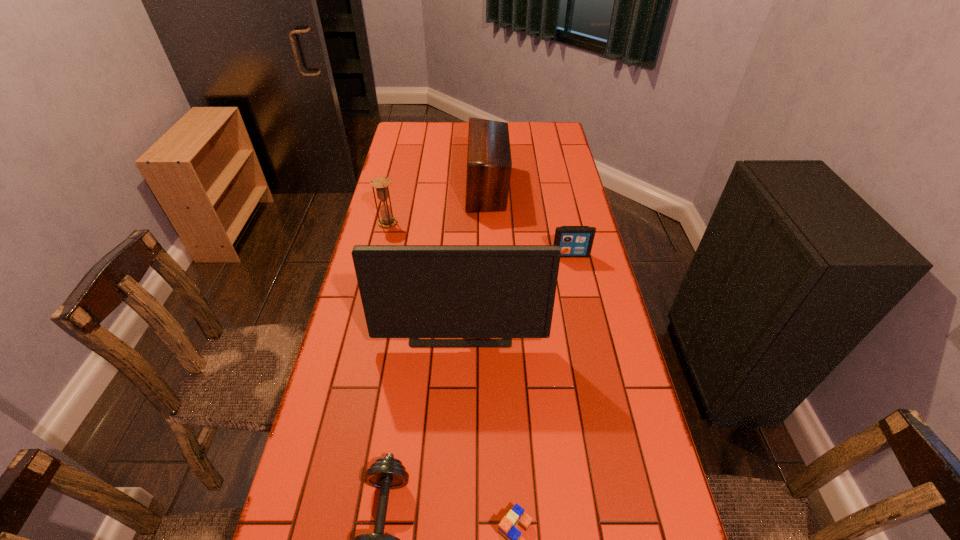
Identify the location of vacant area that lies between the leftmost object and the third farthest object. The width and height of the screenshot is (960, 540). (479, 239).

I want to click on free space that is in between the leftmost object and the fourth nearest object, so click(x=479, y=239).

Locate an element on the screen. object that is the second closest to the hourglass is located at coordinates (408, 291).

I want to click on object that is the fourth closest one to the hourglass, so click(x=387, y=473).